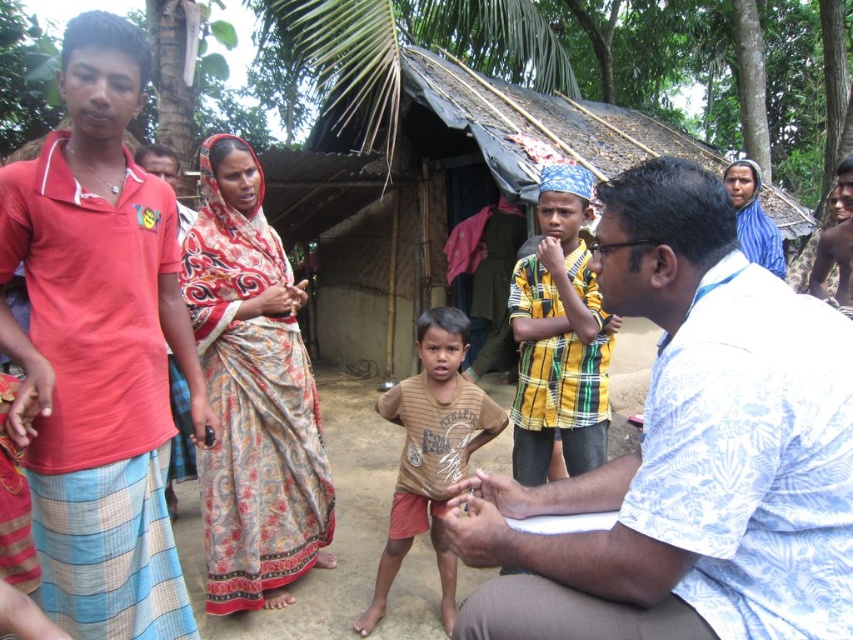
You are a photographer trying to capture a group photo of the people in the scene. You notice the red cotton shirt at left and the printed silk sari at center. Which clothing item should you adjust to ensure both are fully visible in the frame?

You should adjust the red cotton shirt at left because it has a lesser height compared to the printed silk sari at center, so raising or moving it slightly might help both fit into the frame.

You are standing in front of the rustic hut and notice two clothing items nearby. The red cotton shirt at left and the printed silk sari at center. Which clothing item is positioned higher relative to the other?

The red cotton shirt at left is positioned higher than the printed silk sari at center.